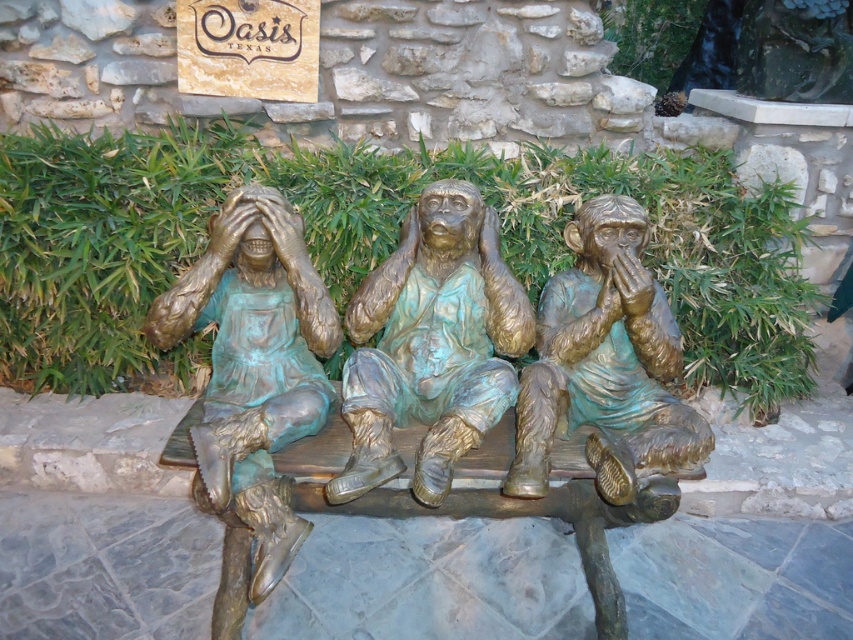
You are standing at the center of the stone paved area and want to move towards the bronze statue at left. Which direction should you move in?

The bronze statue at left is located at point (254,364), so you should move towards the left direction to reach it.

You are standing at the point with coordinates point (431, 344) in the image. What object are you directly facing?

The point (431, 344) corresponds to the bronze statue at center, so you are directly facing the bronze statue at center.

You are a visitor standing in front of the bronze statues. You want to take a photo of the bronze statue at left without the bronze statue at center blocking the view. Is it possible to do so from your current position?

The bronze statue at left is behind the bronze statue at center, so it is blocked from view by the bronze statue at center. Therefore, you cannot take a photo of the bronze statue at left without the bronze statue at center blocking the view from your current position.